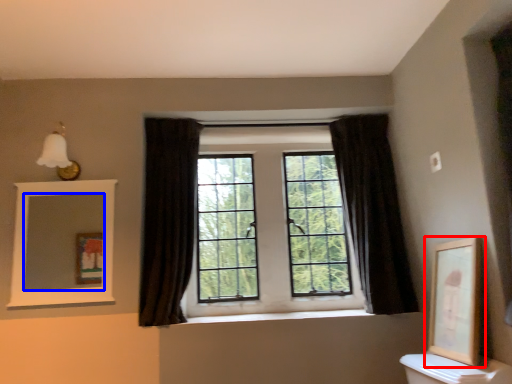
Question: Which point is further to the camera, picture frame (highlighted by a red box) or mirror (highlighted by a blue box)?

Choices:
 (A) picture frame
 (B) mirror

Answer: (B)